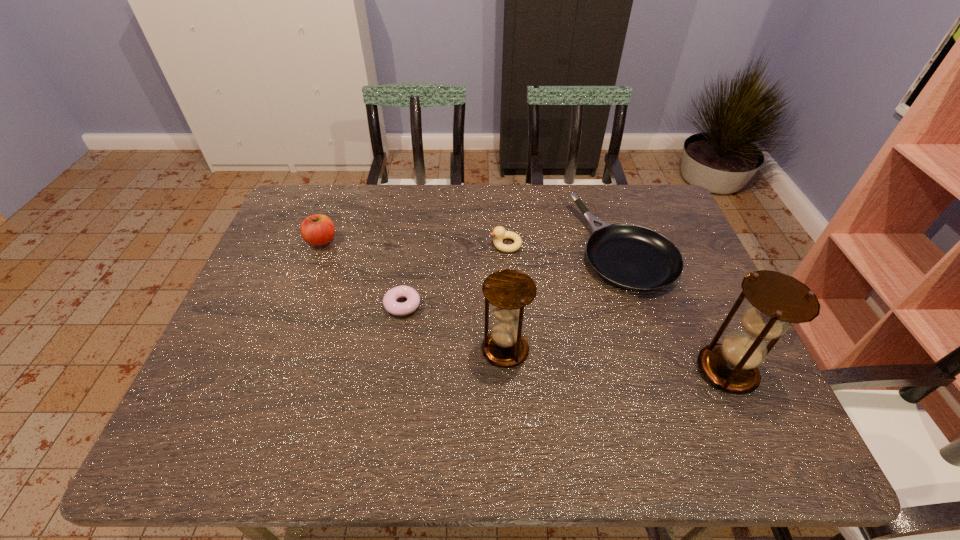
Find the location of `vacant space at the near left corner of the desktop`. vacant space at the near left corner of the desktop is located at coordinates (265, 405).

In the image, there is a desktop. What are the coordinates of `vacant space at the near right corner` in the screenshot? It's located at (754, 393).

This screenshot has height=540, width=960. Find the location of `vacant space in between the duckling and the pan`. vacant space in between the duckling and the pan is located at coordinates (564, 246).

I want to click on free point between the fifth object from right to left and the shorter hourglass, so click(x=454, y=328).

The width and height of the screenshot is (960, 540). I want to click on empty space between the left hourglass and the pan, so click(x=564, y=299).

In order to click on free space between the fifth object from right to left and the taller hourglass in this screenshot , I will do `click(564, 338)`.

The width and height of the screenshot is (960, 540). In order to click on vacant area between the tallest object and the doughnut in this screenshot , I will do `click(564, 338)`.

Identify the location of unoccupied area between the taller hourglass and the doughnut. (564, 338).

Identify the location of vacant region between the leftmost object and the second object from left to right. (362, 273).

Locate an element on the screen. The height and width of the screenshot is (540, 960). empty space between the right hourglass and the duckling is located at coordinates [x=616, y=308].